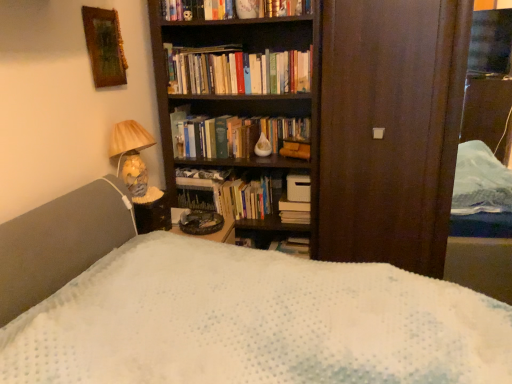
Question: Choose the correct answer: Is matte ceramic lamp at left inside hardcover books at upper center, the 2th book positioned from the back, or outside it?

Choices:
 (A) outside
 (B) inside

Answer: (A)

Question: Looking at their shapes, would you say matte ceramic lamp at left is wider or thinner than hardcover books at upper center, marked as the second book in a bottom-to-top arrangement?

Choices:
 (A) thin
 (B) wide

Answer: (B)

Question: Which object is positioned closest to the matte ceramic lamp at left?

Choices:
 (A) hardcover books at upper center, which is counted as the first book, starting from the top
 (B) hardcover book at center
 (C) hardcover book at center, positioned as the second book in front-to-back order
 (D) wooden picture frame at upper left

Answer: (D)

Question: Which object is positioned farthest from the hardcover book at center, the second book positioned from the top?

Choices:
 (A) wooden picture frame at upper left
 (B) matte ceramic lamp at left
 (C) hardcover book at center
 (D) hardcover books at upper center, marked as the second book in a bottom-to-top arrangement

Answer: (A)